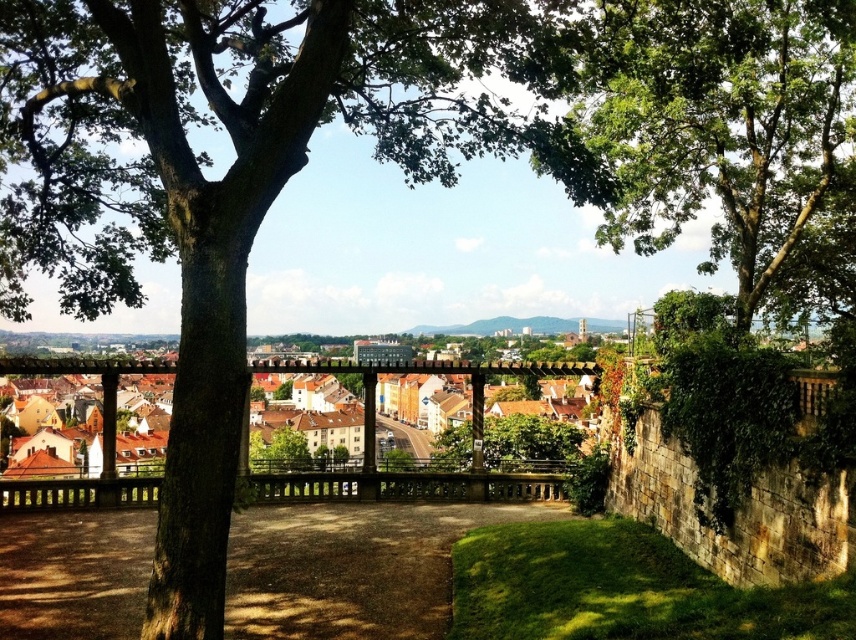
Does point (272, 150) lie behind point (682, 316)?

No.

In the scene shown: Who is positioned more to the left, green rough bark tree at center or green leafy tree at upper right?

From the viewer's perspective, green rough bark tree at center appears more on the left side.

Locate an element on the screen. This screenshot has width=856, height=640. green rough bark tree at center is located at coordinates (241, 179).

Between point (711, 170) and point (500, 452), which one is positioned in front?

Point (500, 452) is more forward.

Locate an element on the screen. The width and height of the screenshot is (856, 640). green leafy tree at upper center is located at coordinates (708, 124).

From the picture: Does green rough bark tree at center have a larger size compared to green leafy tree at center?

Correct, green rough bark tree at center is larger in size than green leafy tree at center.

Which of these two, green rough bark tree at center or green leafy tree at center, stands taller?

With more height is green rough bark tree at center.

Locate an element on the screen. green rough bark tree at center is located at coordinates (241, 179).